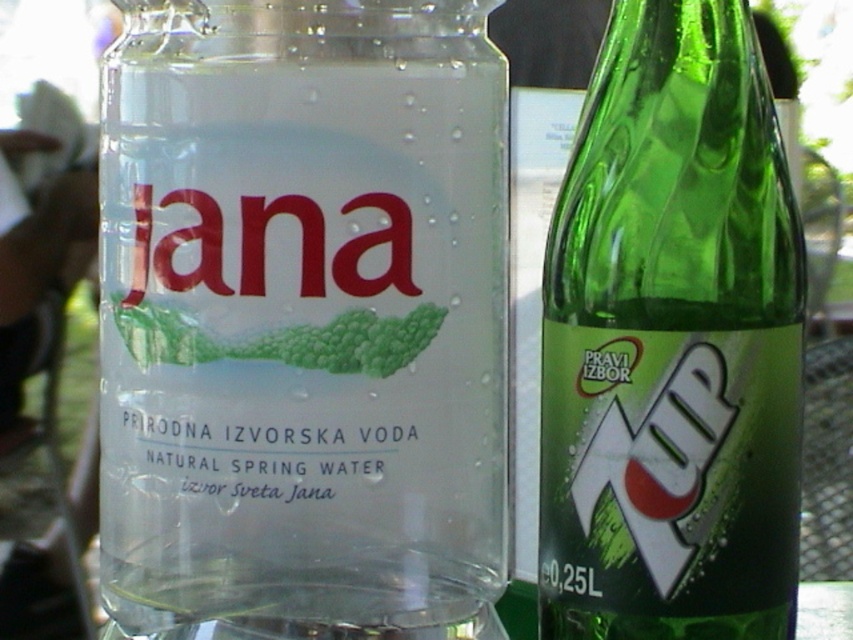
You are at a cafe table where you have a transparent glass bottle at center and a green glass bottle at right. You want to slide a napkin between them. The napkin is 5 centimeters wide. Will it fit between the two bottles?

The transparent glass bottle at center is 5.25 centimeters from the green glass bottle at right. Since the napkin is only 5 centimeters wide, it will fit between them with a small gap remaining.

You are at a cafe table where there are two bottles. One is a clear plastic bottle labeled Jana, and the other is a green glass bottle with the 7UP logo. A point at coordinates point (303, 317) marks the location of the transparent glass bottle at center. If you want to grab the 7UP bottle, which direction should you reach relative to the point marked by the coordinates?

The transparent glass bottle at center is located at point (303, 317). Since the 7UP bottle is the one on the right, you should reach to the right of the marked point to grab it.

You are at a cafe and want to choose a beverage bottle to take home. The transparent glass bottle at center contains sparkling water, while the green glass bottle at right has 7UP. If you want a taller bottle, which one should you choose?

The transparent glass bottle at center is much taller than the green glass bottle at right, so you should choose the transparent glass bottle at center.